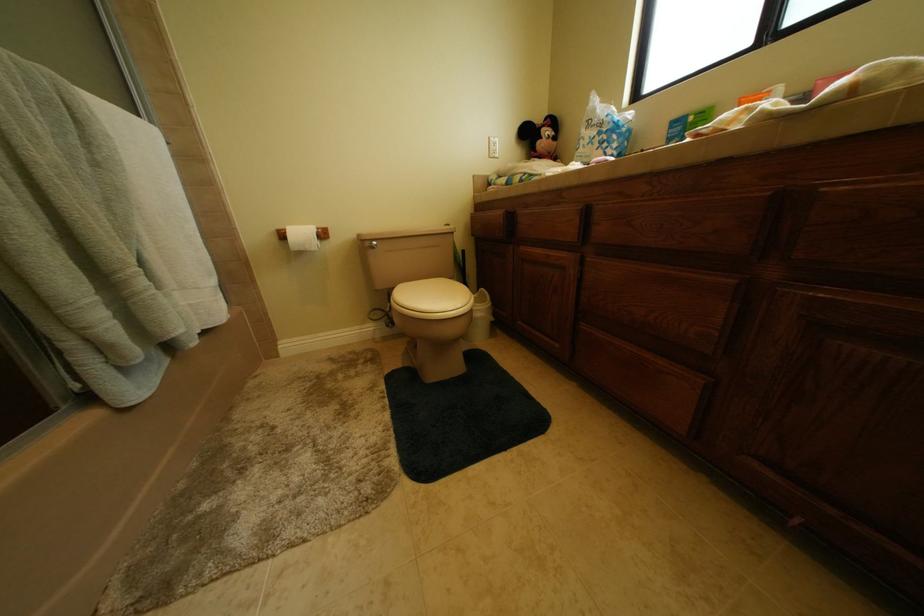
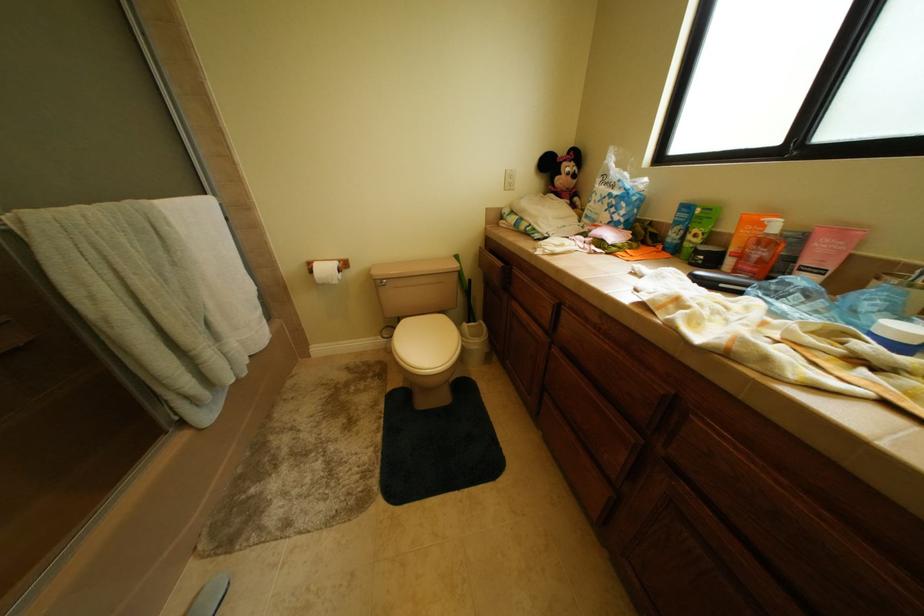
Question: The images are taken continuously from a first-person perspective. In which direction is your viewpoint rotating?

Choices:
 (A) Left
 (B) Right
 (C) Up
 (D) Down

Answer: (D)